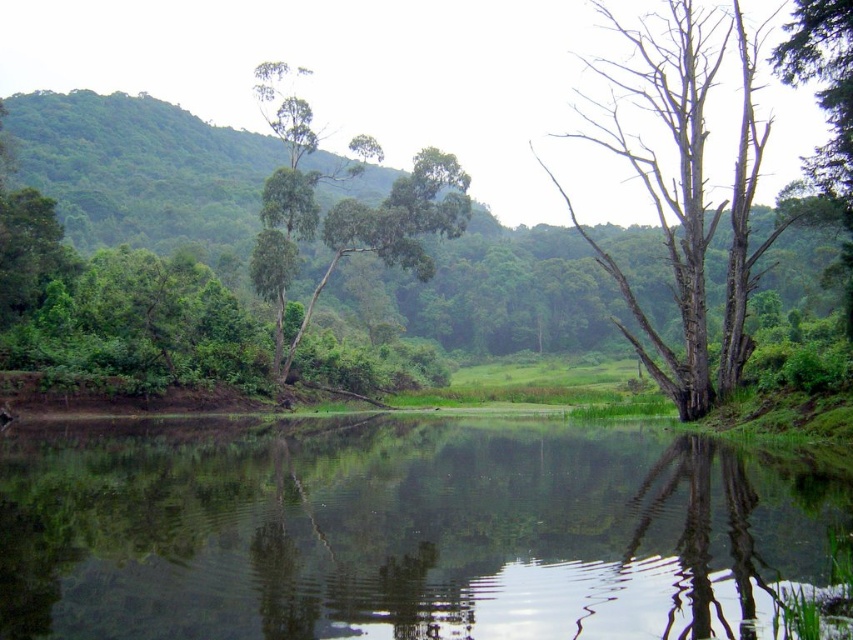
Question: Does green reflective water at center lie behind bare wood tree at right?

Choices:
 (A) yes
 (B) no

Answer: (B)

Question: Which is farther from the green leafy tree at upper center?

Choices:
 (A) bare wood tree at right
 (B) green reflective water at center

Answer: (B)

Question: Is green reflective water at center behind bare wood tree at right?

Choices:
 (A) yes
 (B) no

Answer: (B)

Question: Does green reflective water at center appear on the right side of green leafy tree at upper center?

Choices:
 (A) no
 (B) yes

Answer: (B)

Question: Which object is closer to the camera taking this photo?

Choices:
 (A) green reflective water at center
 (B) bare wood tree at right

Answer: (A)

Question: Estimate the real-world distances between objects in this image. Which object is closer to the green leafy tree at upper center?

Choices:
 (A) bare wood tree at right
 (B) green reflective water at center

Answer: (A)